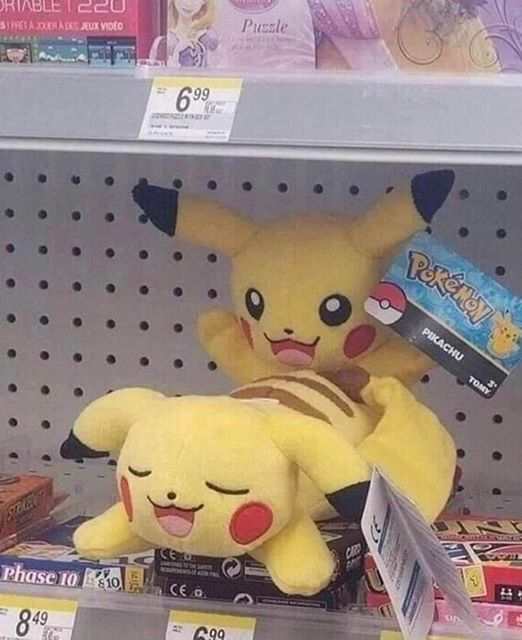
Locate an element on the screen. This screenshot has width=522, height=640. toy is located at coordinates (7, 528), (41, 557), (151, 491), (293, 342), (494, 563), (495, 609), (289, 32), (391, 31), (89, 27).